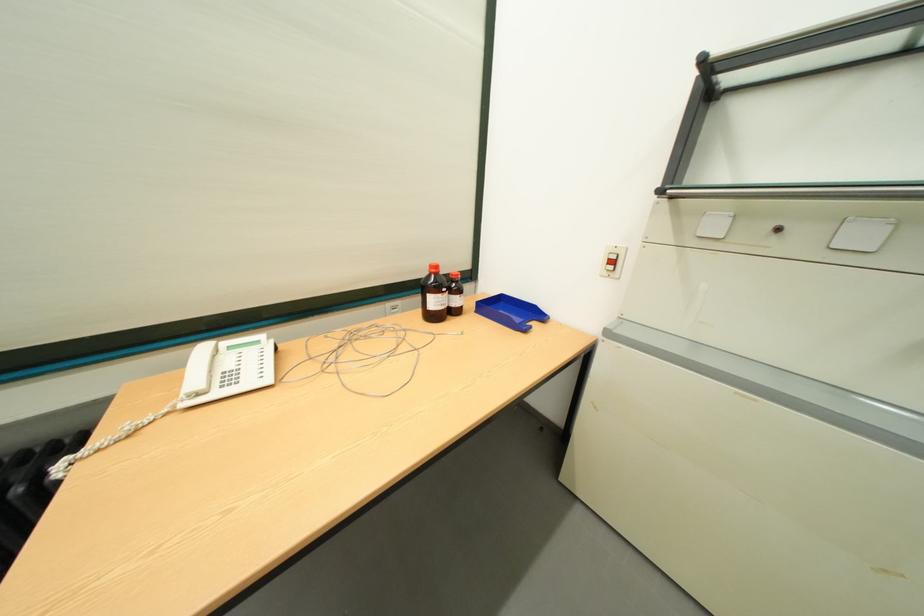
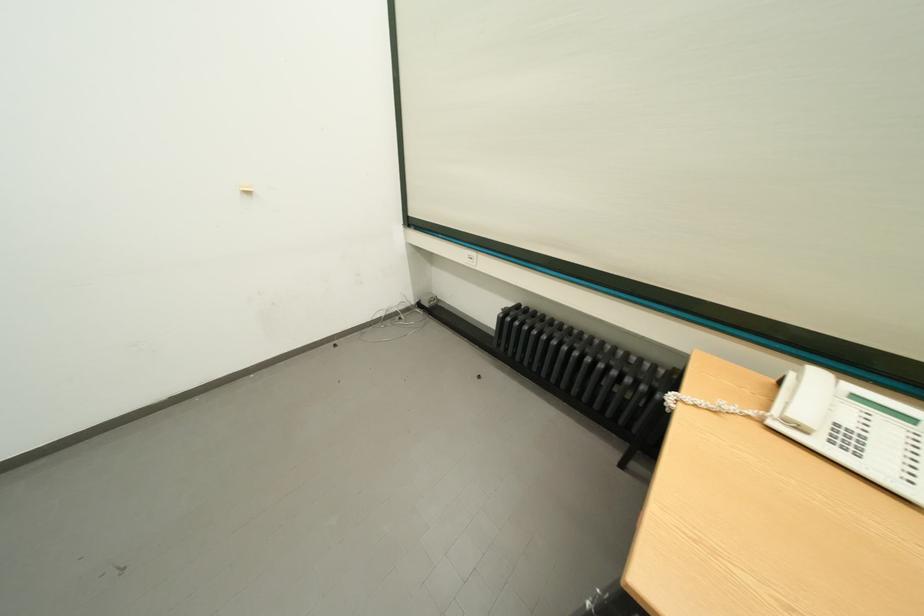
Locate, in the second image, the point that corresponds to (x=208, y=395) in the first image.

(809, 430)